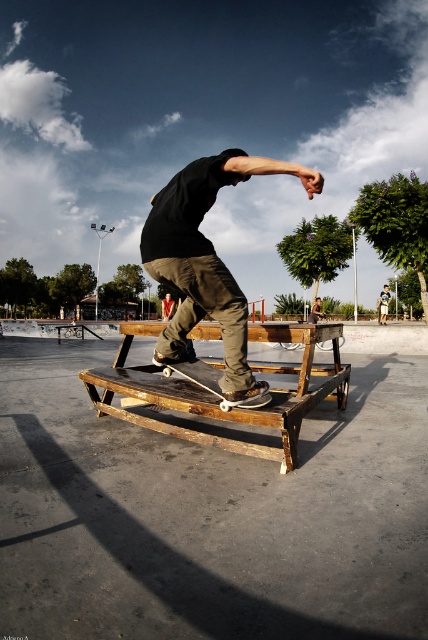
Question: Based on their relative distances, which object is farther from the white plastic skateboard at center?

Choices:
 (A) matte black skateboard at center
 (B) wooden bench at center

Answer: (B)

Question: Considering the relative positions of matte black skateboard at center and white plastic skateboard at center in the image provided, where is matte black skateboard at center located with respect to white plastic skateboard at center?

Choices:
 (A) left
 (B) right

Answer: (B)

Question: Estimate the real-world distances between objects in this image. Which object is closer to the wooden bench at center?

Choices:
 (A) white plastic skateboard at center
 (B) matte black skateboard at center

Answer: (A)

Question: Where is matte black skateboard at center located in relation to white plastic skateboard at center in the image?

Choices:
 (A) left
 (B) right

Answer: (B)

Question: Is matte black skateboard at center wider than wooden bench at center?

Choices:
 (A) no
 (B) yes

Answer: (A)

Question: Which object is closer to the camera taking this photo?

Choices:
 (A) white plastic skateboard at center
 (B) matte black skateboard at center
 (C) wooden bench at center

Answer: (B)